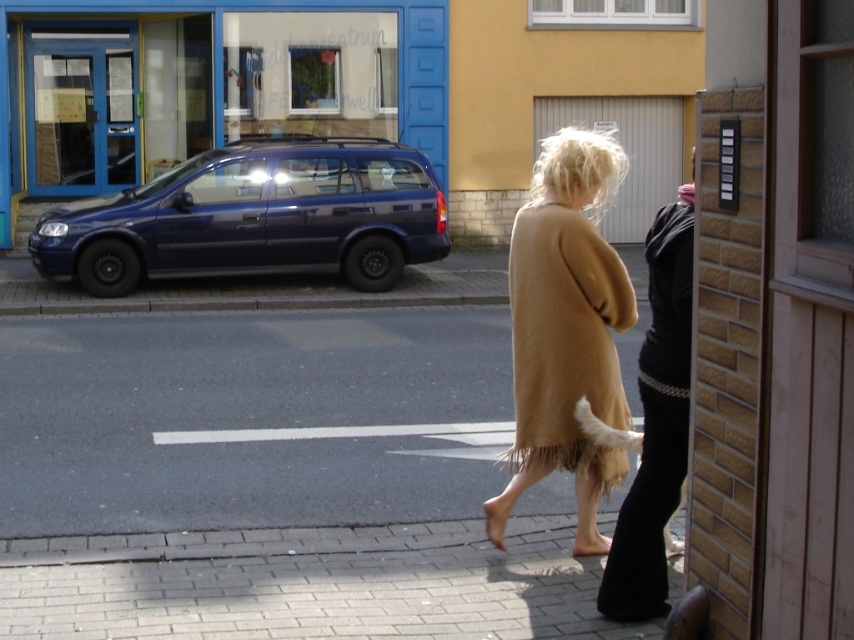
Question: Which point is closer to the camera taking this photo?

Choices:
 (A) (244, 100)
 (B) (597, 136)
 (C) (254, 464)
 (D) (92, 240)

Answer: (B)

Question: Estimate the real-world distances between objects in this image. Which object is closer to the beige fringed coat at center?

Choices:
 (A) smooth concrete pavement at lower center
 (B) glossy blue minivan at left
 (C) brown suede coat at center
 (D) blue metallic car at left

Answer: (C)

Question: Which object is the farthest from the beige fringed coat at center?

Choices:
 (A) blue metallic car at left
 (B) glossy blue minivan at left
 (C) brown suede coat at center

Answer: (A)

Question: Is the position of smooth concrete pavement at lower center less distant than that of brown suede coat at center?

Choices:
 (A) yes
 (B) no

Answer: (B)

Question: Is glossy blue minivan at left thinner than brown suede coat at center?

Choices:
 (A) yes
 (B) no

Answer: (B)

Question: Is smooth concrete pavement at lower center wider than glossy blue minivan at left?

Choices:
 (A) no
 (B) yes

Answer: (B)